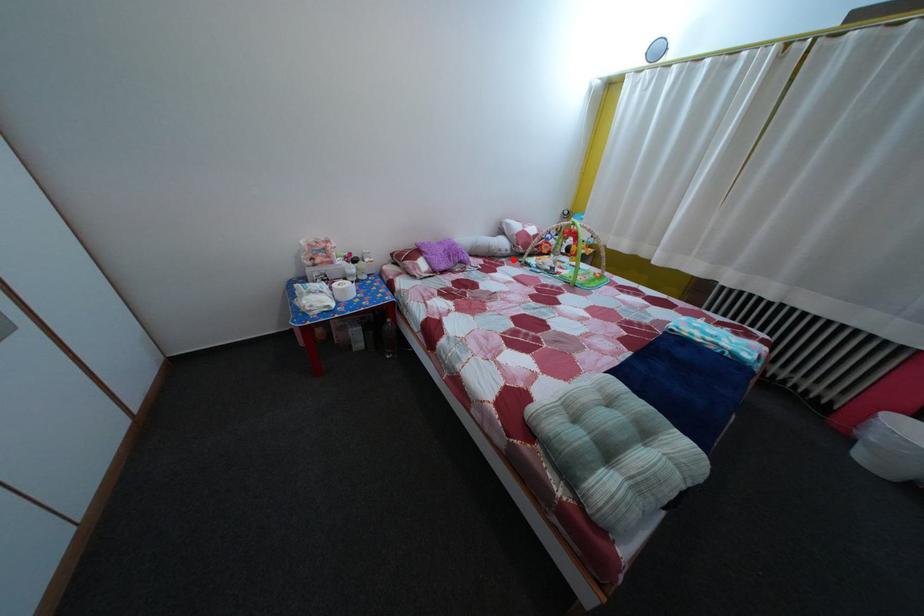
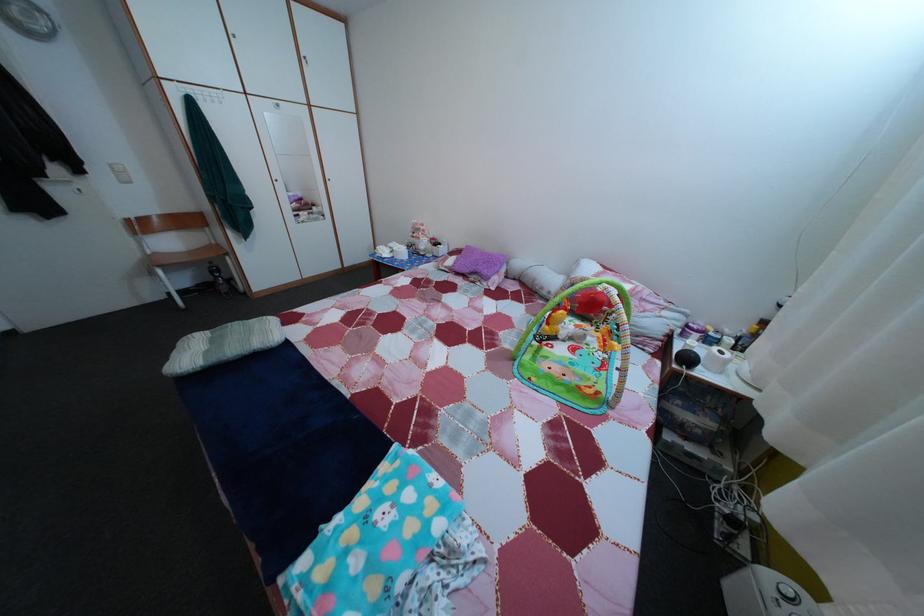
Where in the second image is the point corresponding to the highlighted location from the first image?

(553, 301)